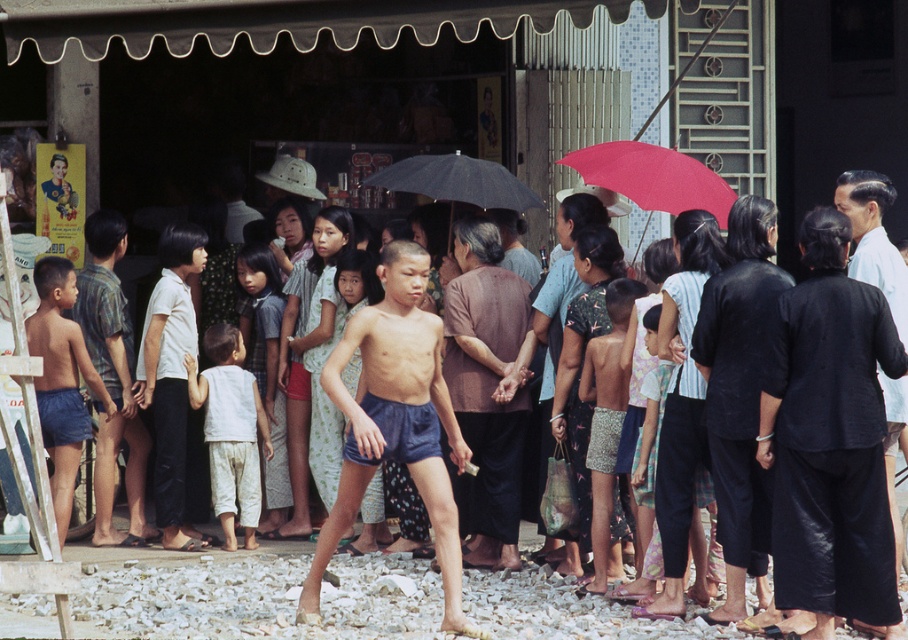
Question: Estimate the real-world distances between objects in this image. Which object is farther from the brown fabric shirt at center?

Choices:
 (A) matte blue shorts at center
 (B) light blue shirt at center

Answer: (B)

Question: Which point is closer to the camera?

Choices:
 (A) (489, 481)
 (B) (233, 348)
 (C) (653, 173)

Answer: (C)

Question: Can you confirm if brown fabric shirt at center is smaller than light blue shirt at center?

Choices:
 (A) no
 (B) yes

Answer: (B)

Question: Based on their relative distances, which object is nearer to the black matte umbrella at center?

Choices:
 (A) printed fabric shorts at center
 (B) red matte umbrella at upper center
 (C) light blue shirt at center
 (D) white cotton shirt at center

Answer: (B)

Question: Is matte blue shorts at center above brown fabric shirt at center?

Choices:
 (A) no
 (B) yes

Answer: (A)

Question: Does matte blue shorts at center have a greater width compared to blue shorts at center?

Choices:
 (A) no
 (B) yes

Answer: (B)